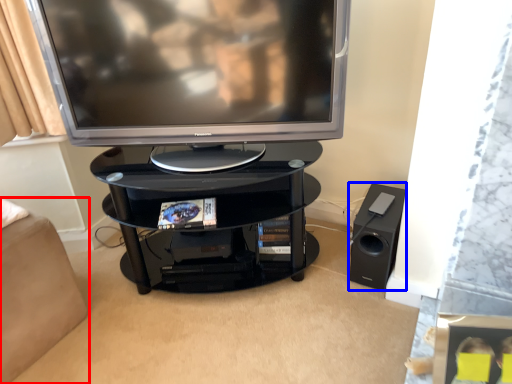
Question: Among these objects, which one is farthest to the camera, furniture (highlighted by a red box) or speaker (highlighted by a blue box)?

Choices:
 (A) furniture
 (B) speaker

Answer: (B)